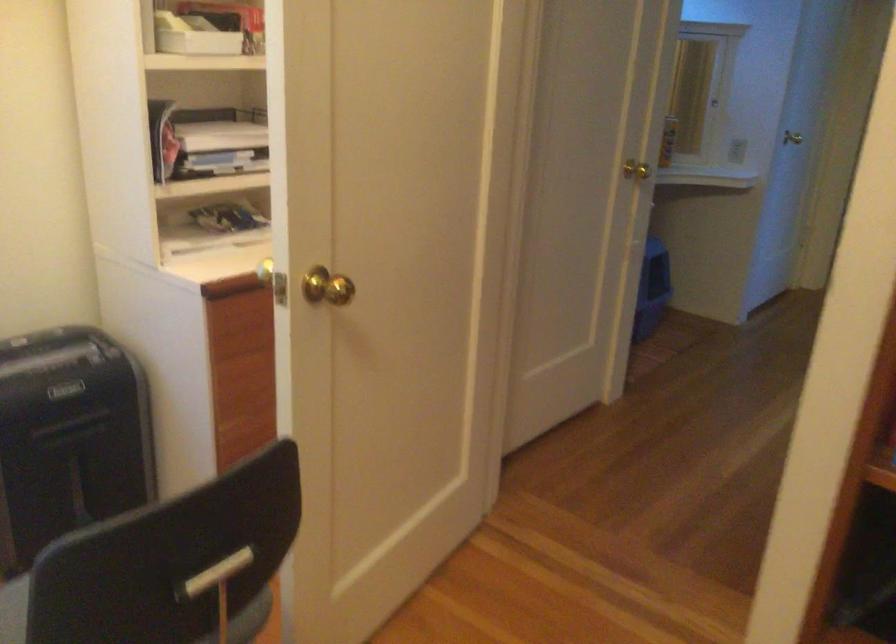
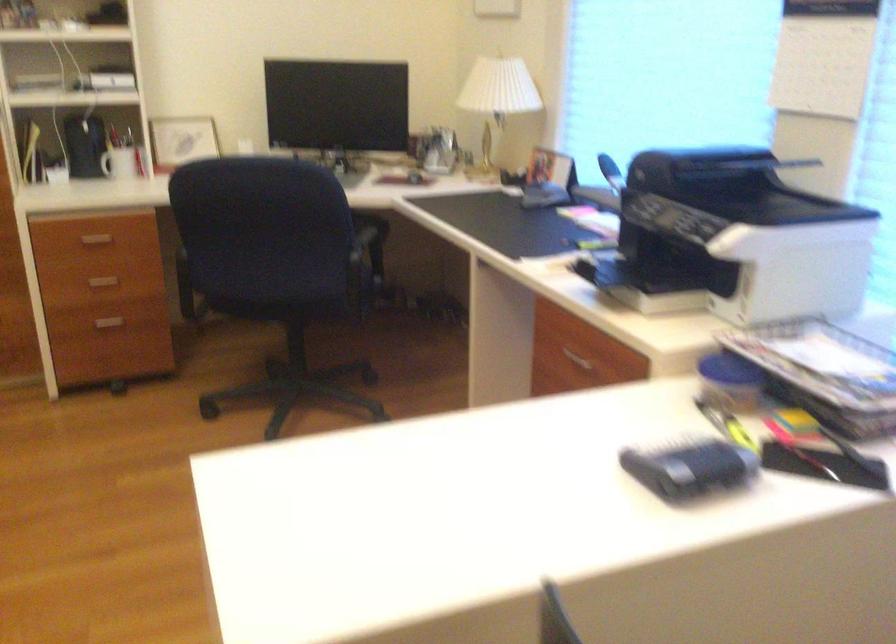
The first image is from the beginning of the video and the second image is from the end. How did the camera likely rotate when shooting the video?

The rotation direction of the camera is left-down.